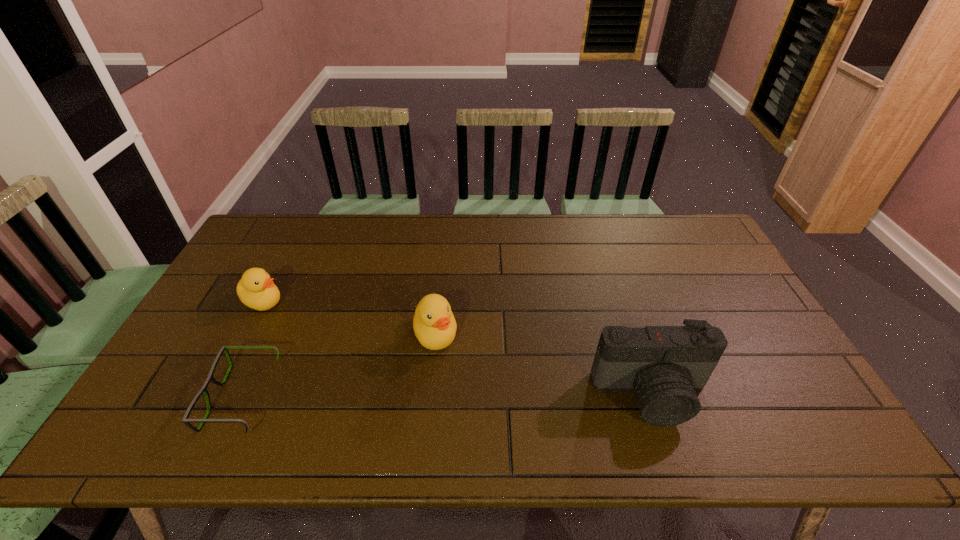
Identify the location of free space located at the beak of the second object from right to left. (450, 409).

You are a GUI agent. You are given a task and a screenshot of the screen. Output one action in this format:
    pyautogui.click(x=<x>, y=<y>)
    Task: Click on the vacant space located 0.080m on the face of the third tallest object
    
    Given the screenshot: What is the action you would take?
    pyautogui.click(x=299, y=318)

This screenshot has height=540, width=960. In order to click on vacant space located 0.060m on the face of the third tallest object in this screenshot , I will do `click(294, 315)`.

I want to click on vacant area situated 0.260m on the face of the third tallest object, so click(x=345, y=343).

What are the coordinates of `spectacles at the near edge` in the screenshot? It's located at (185, 420).

I want to click on camera at the near edge, so click(665, 365).

Locate an element on the screen. object that is at the left edge is located at coordinates (256, 289).

Identify the location of vacant space at the far edge of the desktop. (385, 214).

Find the location of `free space at the left edge`. free space at the left edge is located at coordinates (189, 366).

This screenshot has width=960, height=540. What are the coordinates of `vacant space at the right edge` in the screenshot? It's located at (754, 305).